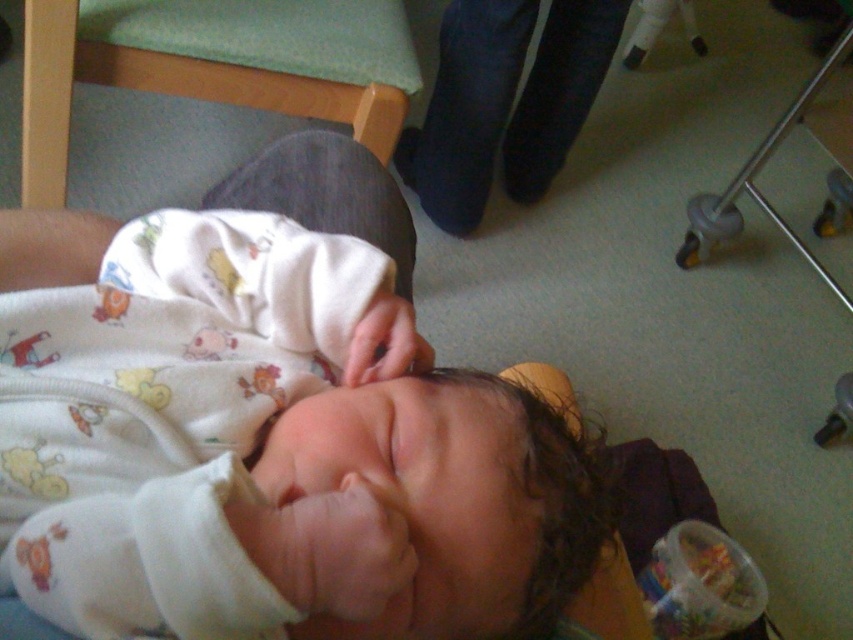
How far apart are white soft fabric newborn at center and smooth skin hand at center?

white soft fabric newborn at center is 4.78 inches away from smooth skin hand at center.

Based on the photo, does white soft fabric newborn at center have a lesser height compared to smooth skin hand at center?

Incorrect, white soft fabric newborn at center's height does not fall short of smooth skin hand at center's.

Which is in front, point (234, 600) or point (395, 307)?

Point (234, 600)

The image size is (853, 640). What are the coordinates of `white soft fabric newborn at center` in the screenshot? It's located at (294, 452).

Between dark blue jeans at upper center and smooth skin hand at center, which one has more height?

Standing taller between the two is dark blue jeans at upper center.

Is dark blue jeans at upper center bigger than smooth skin hand at center?

Yes, dark blue jeans at upper center is bigger than smooth skin hand at center.

This screenshot has width=853, height=640. Describe the element at coordinates (503, 102) in the screenshot. I see `dark blue jeans at upper center` at that location.

I want to click on dark blue jeans at upper center, so click(x=503, y=102).

Can you confirm if white soft fabric newborn at center is bigger than dark blue jeans at upper center?

No, white soft fabric newborn at center is not bigger than dark blue jeans at upper center.

Measure the distance between white soft fabric newborn at center and camera.

A distance of 16.12 inches exists between white soft fabric newborn at center and camera.

Does point (506, 390) come in front of point (515, 115)?

That is True.

You are a GUI agent. You are given a task and a screenshot of the screen. Output one action in this format:
    pyautogui.click(x=<x>, y=<y>)
    Task: Click on the white soft fabric newborn at center
    
    Given the screenshot: What is the action you would take?
    pyautogui.click(x=294, y=452)